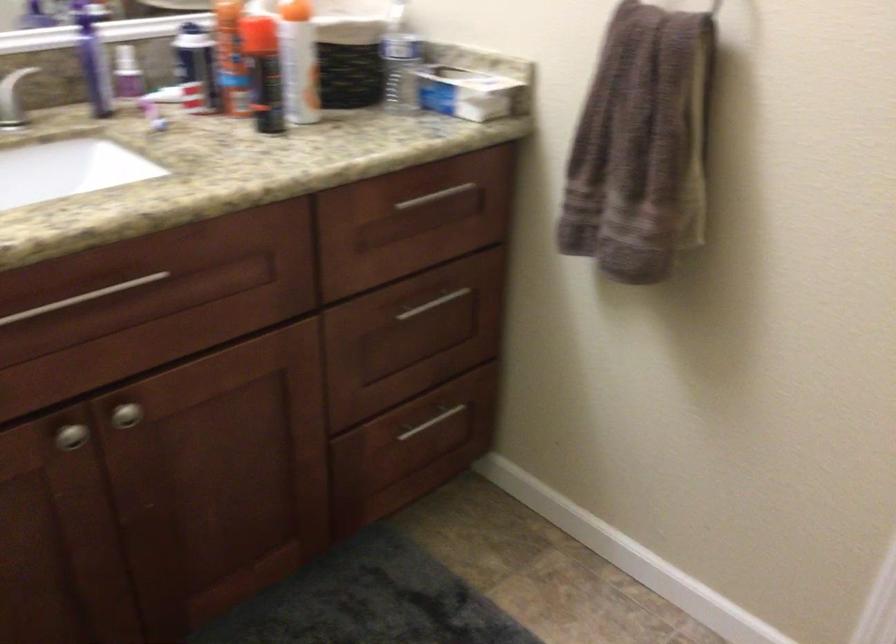
The location [263,73] corresponds to which object?

It refers to a orange spray can.